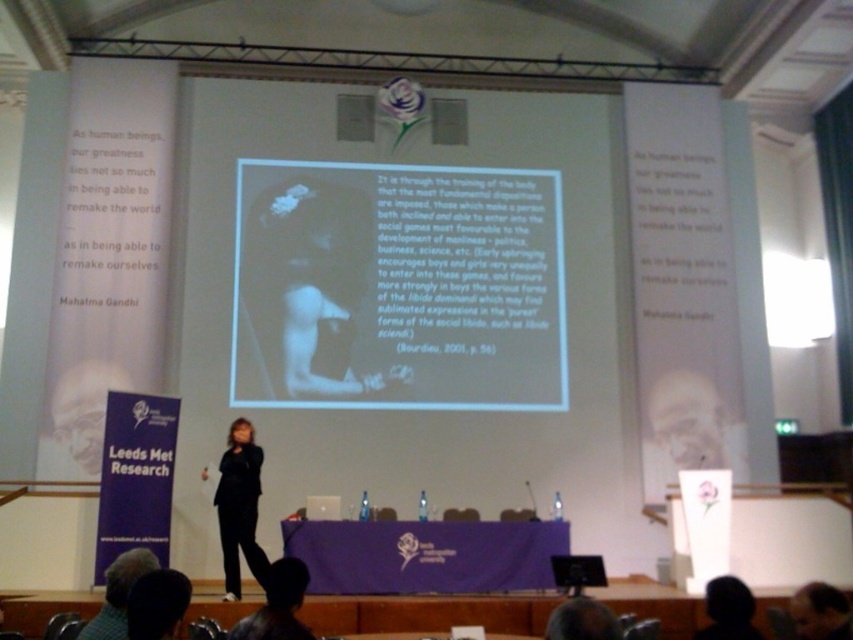
You are an attendee at the presentation and notice two objects on the screen. Which one is taller between the smooth skin face at upper right and the black matte head at lower right?

The smooth skin face at upper right is taller than the black matte head at lower right.

What are the coordinates of the black matte figure at center in the image?

The black matte figure at center is located at point (309, 289).

In the scene shown: You are an attendee at the presentation and want to take a photo of the projection screen. The screen has two points marked at coordinates point (326,234) and point (700,433). Which point is closer to the camera lens?

Point (700,433) is closer to the camera lens because point (326,234) is behind it.